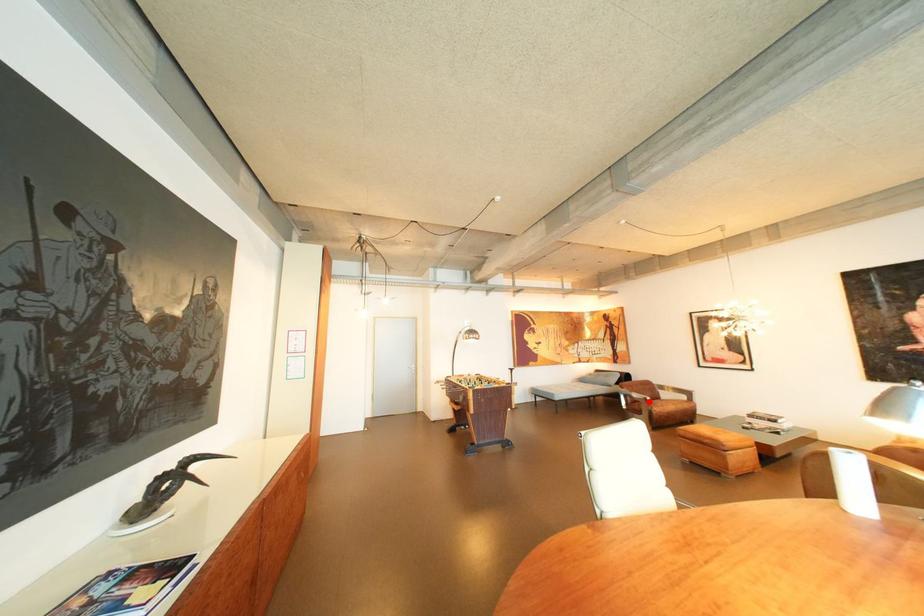
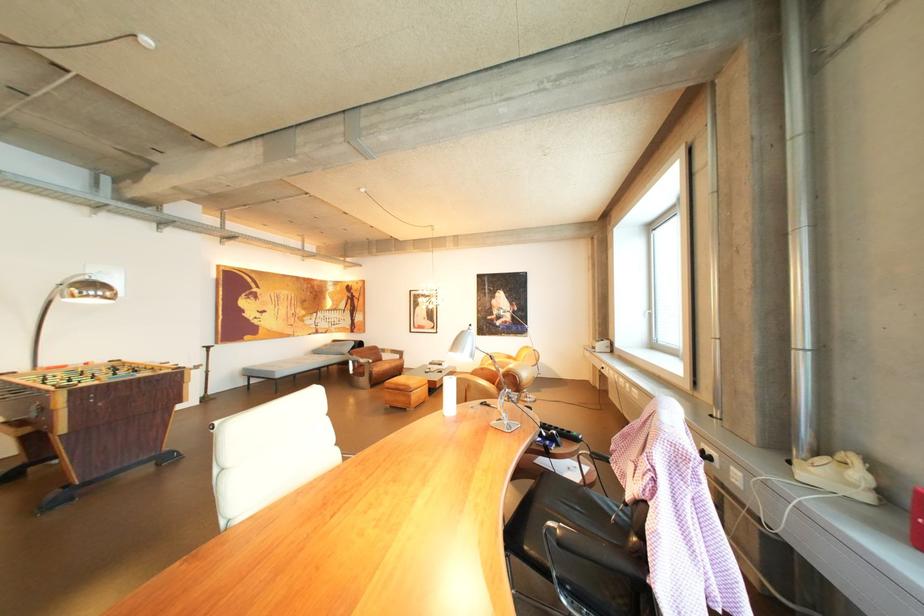
Question: I am providing you with two images of the same scene from different viewpoints. In image1, a red point is highlighted. Considering the same 3D point in image2, which of the following is correct?

Choices:
 (A) It is closer
 (B) It is farther

Answer: (A)